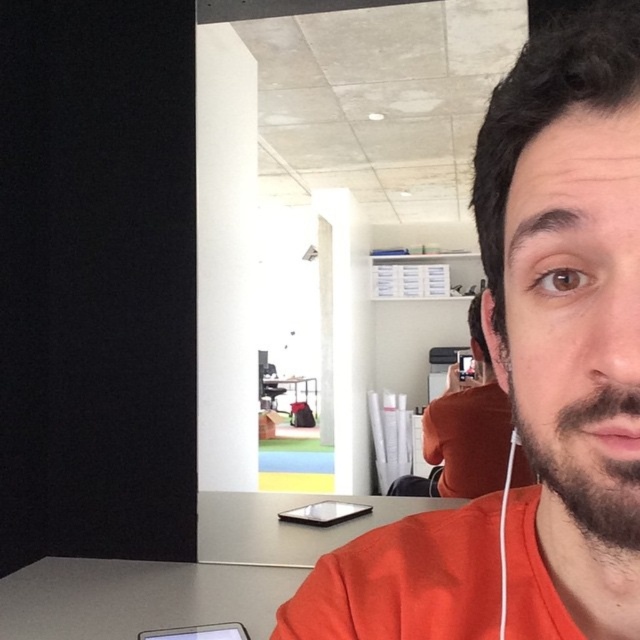
What is located at the coordinate point (588, 465) in the image?

The point (588, 465) in the image corresponds to brownbeard at right.

You are a delivery robot in an office. You need to place a package on the gray matte table at lower left. The orange matte shirt at upper right is in your path. Is there enough space to move around it without touching?

The distance between the orange matte shirt at upper right and the gray matte table at lower left is 3.58 feet. Since the robot needs to navigate around the shirt, this distance should provide sufficient space to maneuver safely without touching either object.